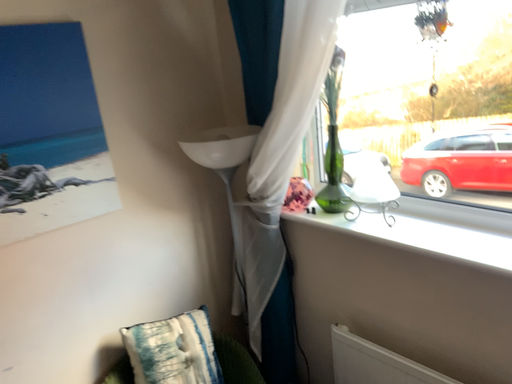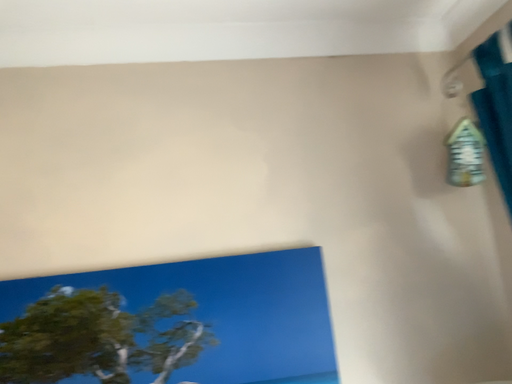
Question: How did the camera likely rotate when shooting the video?

Choices:
 (A) rotated upward
 (B) rotated downward

Answer: (A)